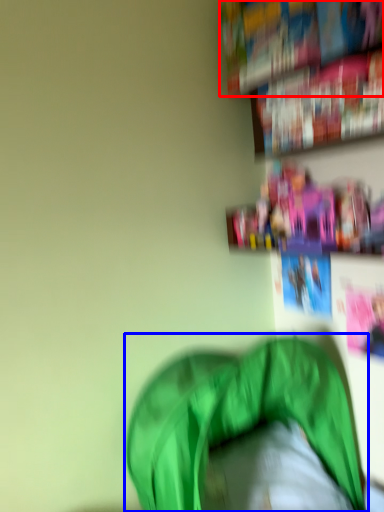
Question: Which object is closer to the camera taking this photo, book (highlighted by a red box) or bean bag chair (highlighted by a blue box)?

Choices:
 (A) book
 (B) bean bag chair

Answer: (B)